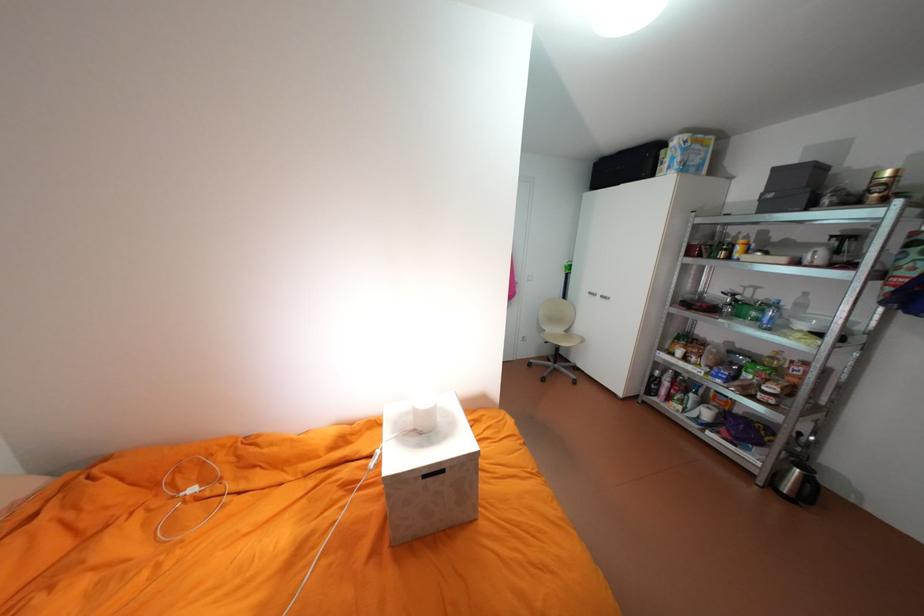
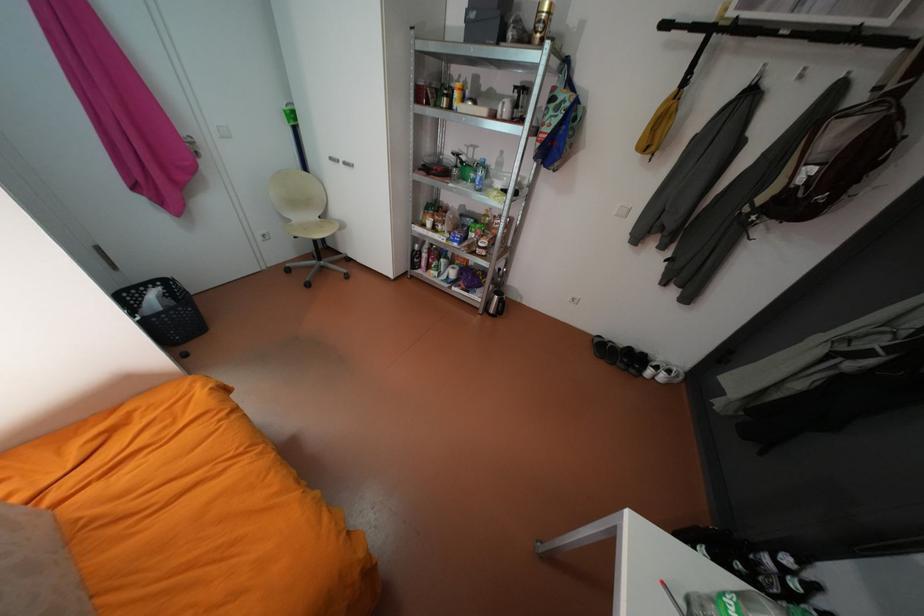
In the second image, find the point that corresponds to point (603, 294) in the first image.

(347, 160)